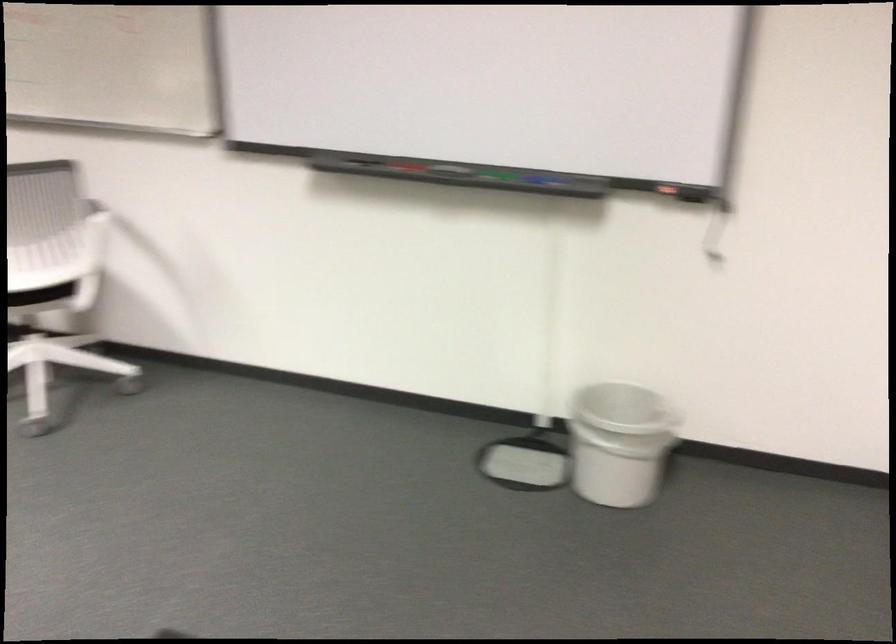
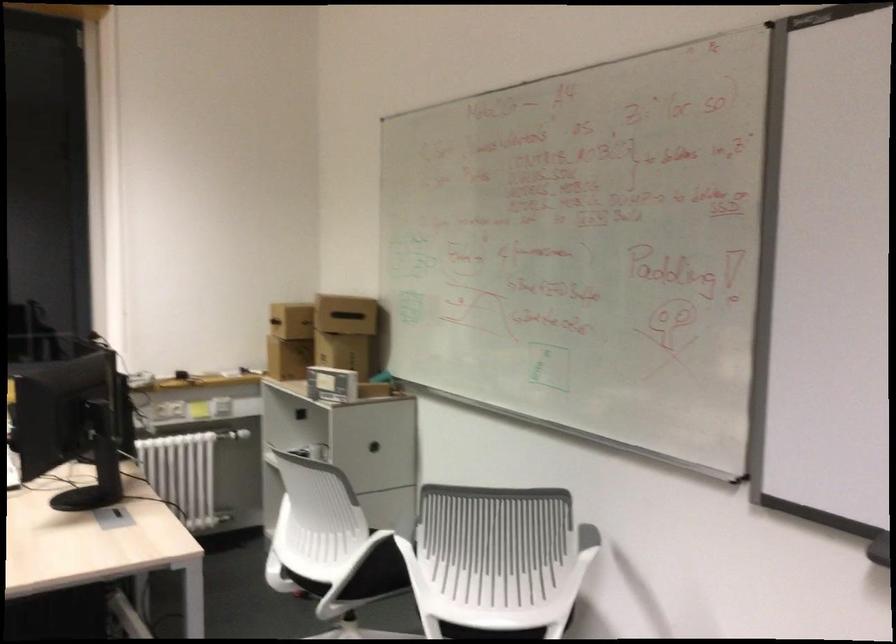
Question: The camera is either moving clockwise (left) or counter-clockwise (right) around the object. The first image is from the beginning of the video and the second image is from the end. Is the camera moving left or right when shooting the video?

Choices:
 (A) Left
 (B) Right

Answer: (B)